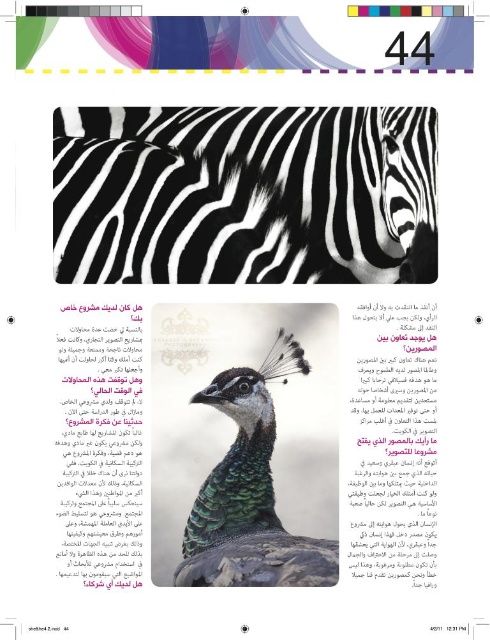
Is black and white stripes at center bigger than shiny green peacock at center?

Indeed, black and white stripes at center has a larger size compared to shiny green peacock at center.

Identify the location of black and white stripes at center. This screenshot has width=490, height=640. (316, 168).

Who is more distant from viewer, (180,129) or (217,502)?

The point (180,129) is more distant.

You are a GUI agent. You are given a task and a screenshot of the screen. Output one action in this format:
    pyautogui.click(x=<x>, y=<y>)
    Task: Click on the black and white stripes at center
    The image size is (490, 640).
    Given the screenshot: What is the action you would take?
    pyautogui.click(x=316, y=168)